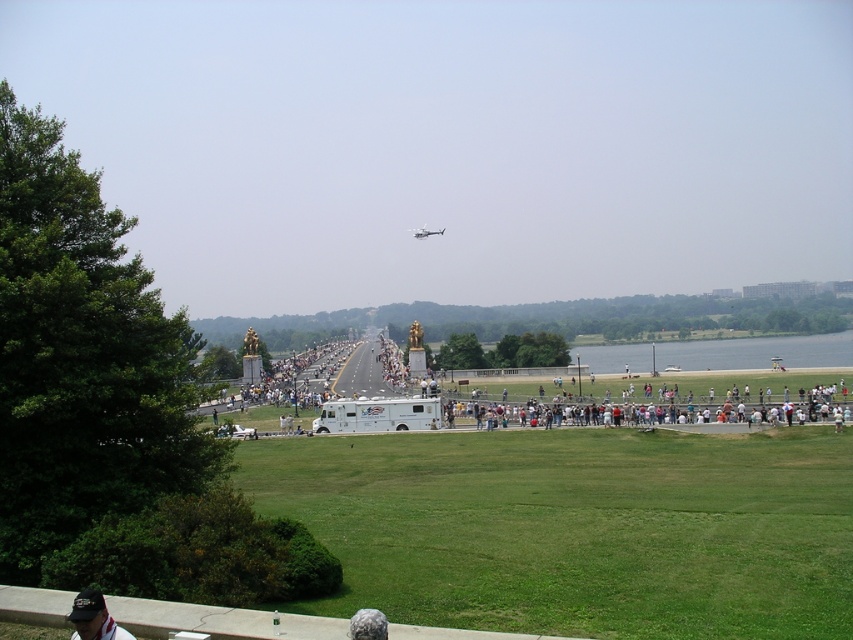
Question: Does white fabric cap at lower left have a greater width compared to metallic silver helicopter at center?

Choices:
 (A) no
 (B) yes

Answer: (A)

Question: Which object is the closest to the white fabric cap at lower left?

Choices:
 (A) metallic silver helicopter at center
 (B) white van at center

Answer: (B)

Question: Does white van at center appear on the left side of metallic silver helicopter at center?

Choices:
 (A) no
 (B) yes

Answer: (A)

Question: Is white van at center positioned behind metallic silver helicopter at center?

Choices:
 (A) yes
 (B) no

Answer: (B)

Question: Estimate the real-world distances between objects in this image. Which object is closer to the metallic silver helicopter at center?

Choices:
 (A) white fabric cap at lower left
 (B) white van at center

Answer: (B)

Question: Which point is farther to the camera?

Choices:
 (A) white fabric cap at lower left
 (B) white van at center
 (C) metallic silver helicopter at center

Answer: (C)